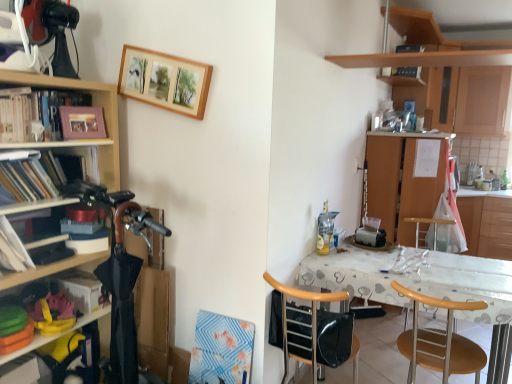
Question: Is wooden bookshelf at left, the second shelf positioned from the top, inside wooden cabinet at right, the first cabinetry viewed from the left?

Choices:
 (A) yes
 (B) no

Answer: (B)

Question: From the image's perspective, is wooden cabinet at right, acting as the 3th cabinetry starting from the right, beneath wooden bookshelf at left, arranged as the second shelf when ordered from the bottom?

Choices:
 (A) no
 (B) yes

Answer: (B)

Question: Can you confirm if wooden cabinet at right, the first cabinetry viewed from the left, is positioned to the right of wooden bookshelf at left, arranged as the second shelf when ordered from the bottom?

Choices:
 (A) yes
 (B) no

Answer: (A)

Question: From a real-world perspective, is wooden cabinet at right, acting as the 3th cabinetry starting from the right, positioned over wooden bookshelf at left, arranged as the second shelf when ordered from the bottom, based on gravity?

Choices:
 (A) yes
 (B) no

Answer: (B)

Question: Is wooden cabinet at right, the first cabinetry viewed from the left, not near wooden bookshelf at left, the second shelf positioned from the top?

Choices:
 (A) yes
 (B) no

Answer: (A)

Question: Does wooden cabinet at right, acting as the 3th cabinetry starting from the right, turn towards wooden bookshelf at left, arranged as the second shelf when ordered from the bottom?

Choices:
 (A) yes
 (B) no

Answer: (B)

Question: From the image's perspective, does wooden bar stool at center appear lower than white paper at left, the 2th book positioned from the bottom?

Choices:
 (A) no
 (B) yes

Answer: (B)

Question: From a real-world perspective, is wooden bar stool at center physically above white paper at left, the first book viewed from the front?

Choices:
 (A) no
 (B) yes

Answer: (A)

Question: Considering the relative sizes of wooden bar stool at center and white paper at left, the 2th book positioned from the bottom, in the image provided, is wooden bar stool at center shorter than white paper at left, the 2th book positioned from the bottom,?

Choices:
 (A) yes
 (B) no

Answer: (B)

Question: Is the surface of wooden bar stool at center in direct contact with white paper at left, positioned as the 2th book in back-to-front order?

Choices:
 (A) no
 (B) yes

Answer: (A)

Question: Is wooden bar stool at center at the left side of white paper at left, the first book from the top?

Choices:
 (A) yes
 (B) no

Answer: (B)

Question: From the image's perspective, is wooden bar stool at center over white paper at left, the first book viewed from the front?

Choices:
 (A) yes
 (B) no

Answer: (B)

Question: Is wooden at right, the second chair when ordered from left to right, looking in the opposite direction of white paper at left, the 2th book positioned from the bottom?

Choices:
 (A) no
 (B) yes

Answer: (A)